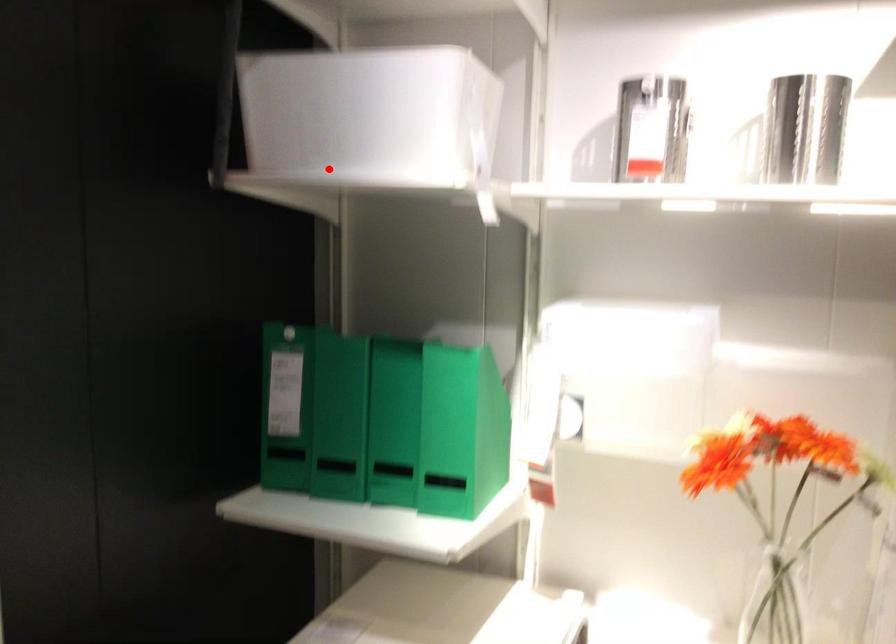
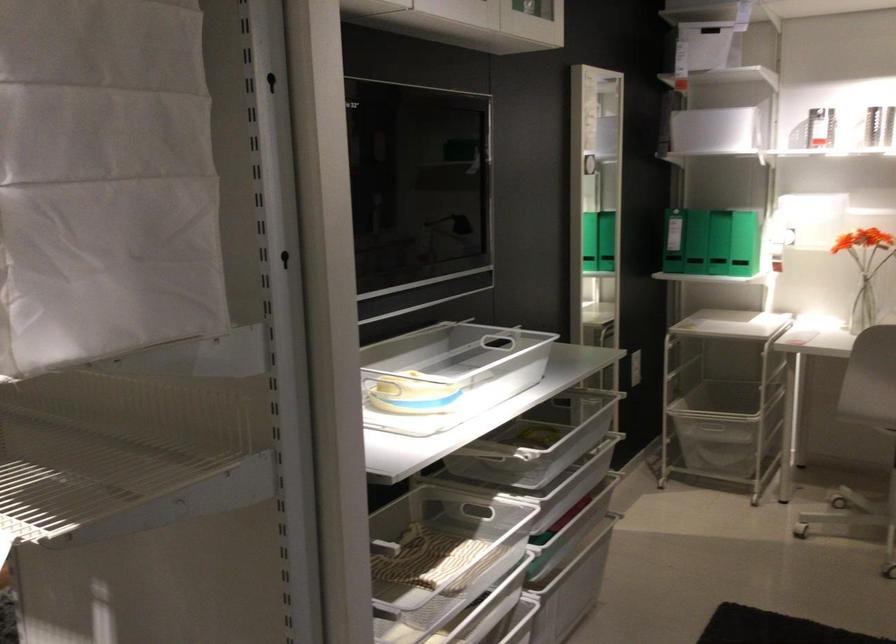
Find the pixel in the second image that matches the highlighted location in the first image.

(716, 133)